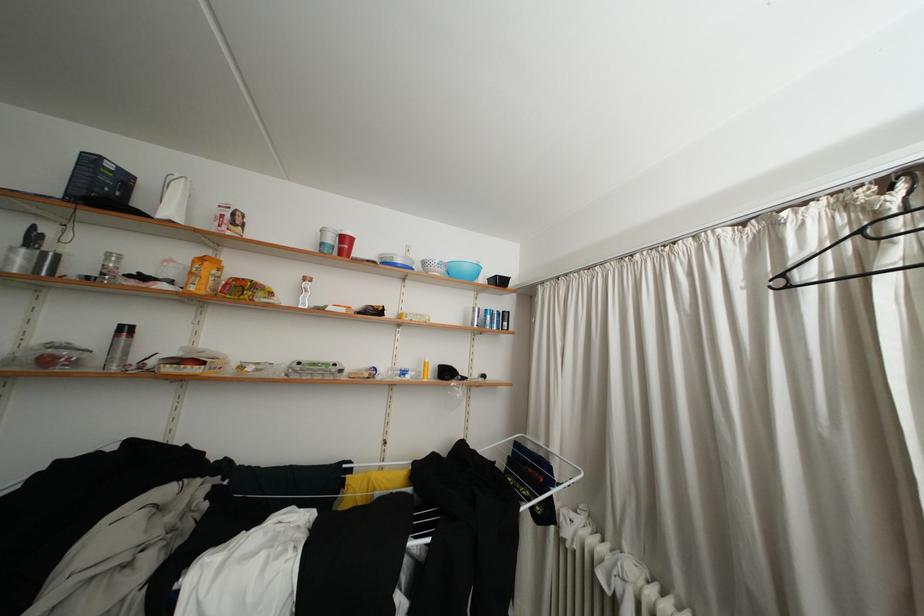
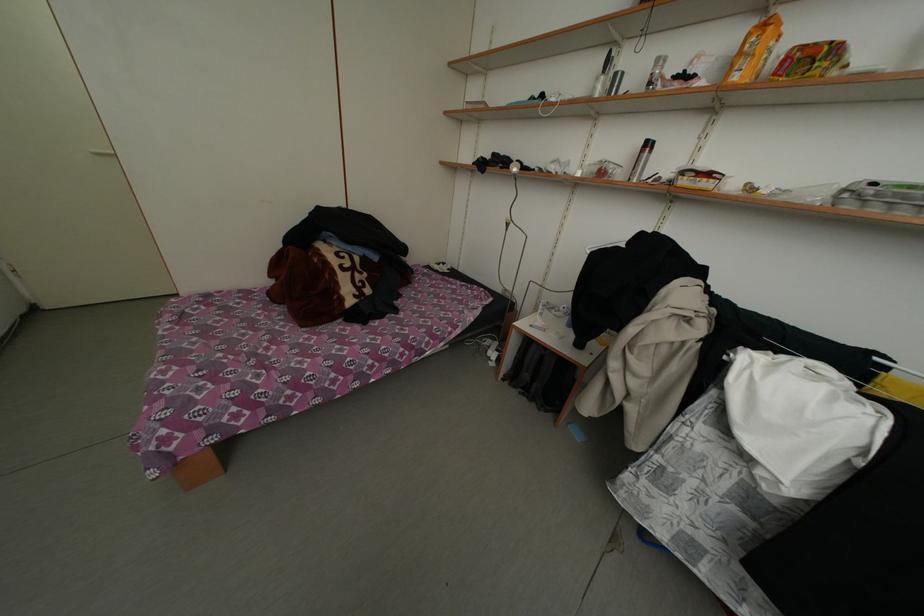
Locate, in the second image, the point that corresponds to point 307,369 in the first image.

(881, 188)